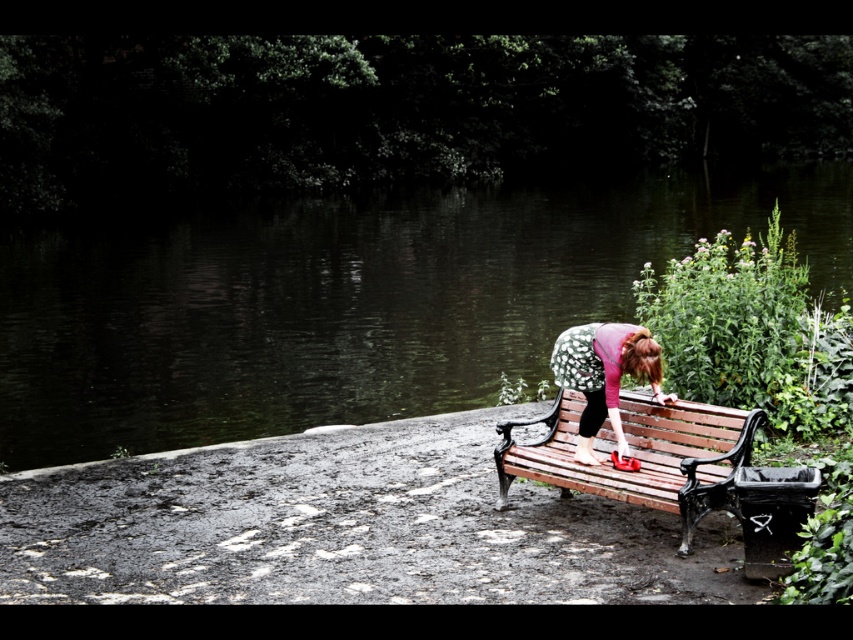
Question: Which object appears farthest from the camera in this image?

Choices:
 (A) wooden bench at center
 (B) floral fabric dress at center
 (C) dark green water at center

Answer: (C)

Question: Can you confirm if dark green water at center is positioned to the left of wooden bench at center?

Choices:
 (A) yes
 (B) no

Answer: (A)

Question: Which object is the closest to the dark green water at center?

Choices:
 (A) floral fabric dress at center
 (B) wooden bench at center

Answer: (B)

Question: Which point appears closest to the camera in this image?

Choices:
 (A) (614, 378)
 (B) (656, 506)
 (C) (178, 435)

Answer: (B)

Question: Can you confirm if dark green water at center is positioned above floral fabric dress at center?

Choices:
 (A) no
 (B) yes

Answer: (B)

Question: Is dark green water at center positioned before floral fabric dress at center?

Choices:
 (A) no
 (B) yes

Answer: (A)